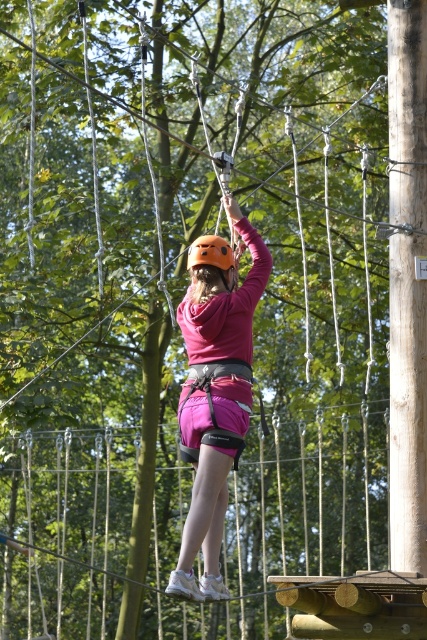
Question: Which object is the farthest from the smooth brown wooden pole at right?

Choices:
 (A) orange matte helmet at center
 (B) pink matte shorts at center

Answer: (A)

Question: Considering the relative positions of pink matte shorts at center and orange matte helmet at center in the image provided, where is pink matte shorts at center located with respect to orange matte helmet at center?

Choices:
 (A) right
 (B) left

Answer: (A)

Question: Does smooth brown wooden pole at right appear on the right side of orange matte helmet at center?

Choices:
 (A) no
 (B) yes

Answer: (B)

Question: Is pink matte shorts at center thinner than orange matte helmet at center?

Choices:
 (A) no
 (B) yes

Answer: (A)

Question: Among these points, which one is farthest from the camera?

Choices:
 (A) (195, 289)
 (B) (403, 76)
 (C) (219, 264)

Answer: (B)

Question: Which of the following is the farthest from the observer?

Choices:
 (A) (198, 364)
 (B) (192, 243)
 (C) (409, 26)

Answer: (C)